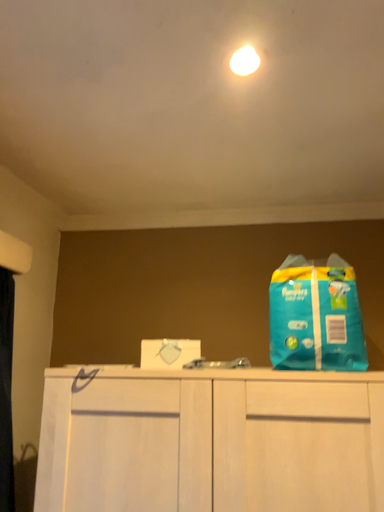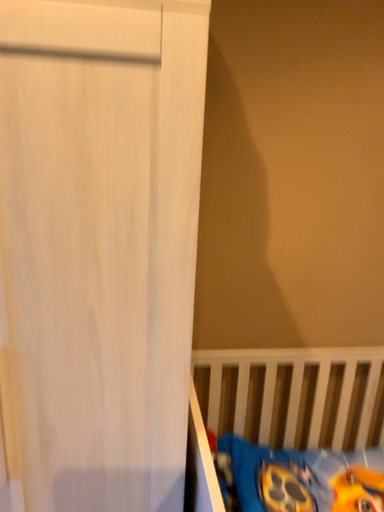
Question: How did the camera likely rotate when shooting the video?

Choices:
 (A) rotated upward
 (B) rotated downward

Answer: (B)